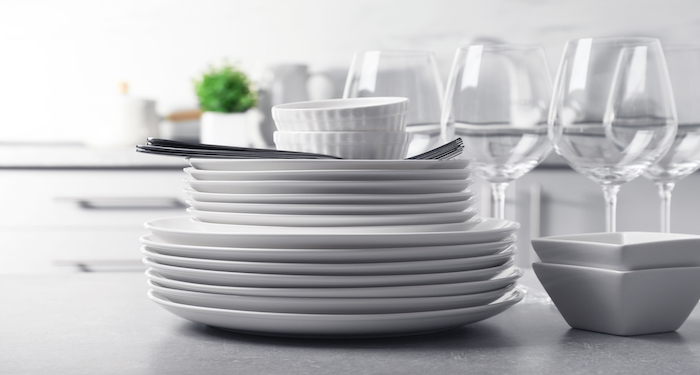
Locate an element on the screen. Image resolution: width=700 pixels, height=375 pixels. glass is located at coordinates (484, 101), (589, 101), (679, 61), (386, 77).